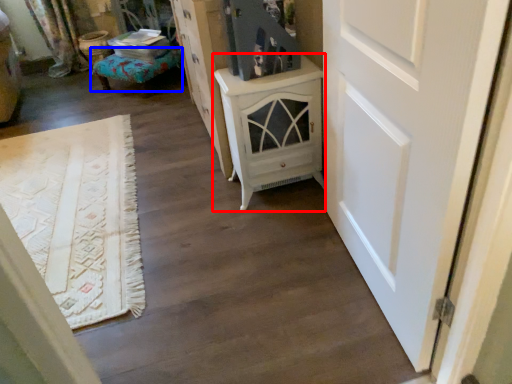
Question: Which object is closer to the camera taking this photo, chest of drawers (highlighted by a red box) or furniture (highlighted by a blue box)?

Choices:
 (A) chest of drawers
 (B) furniture

Answer: (A)